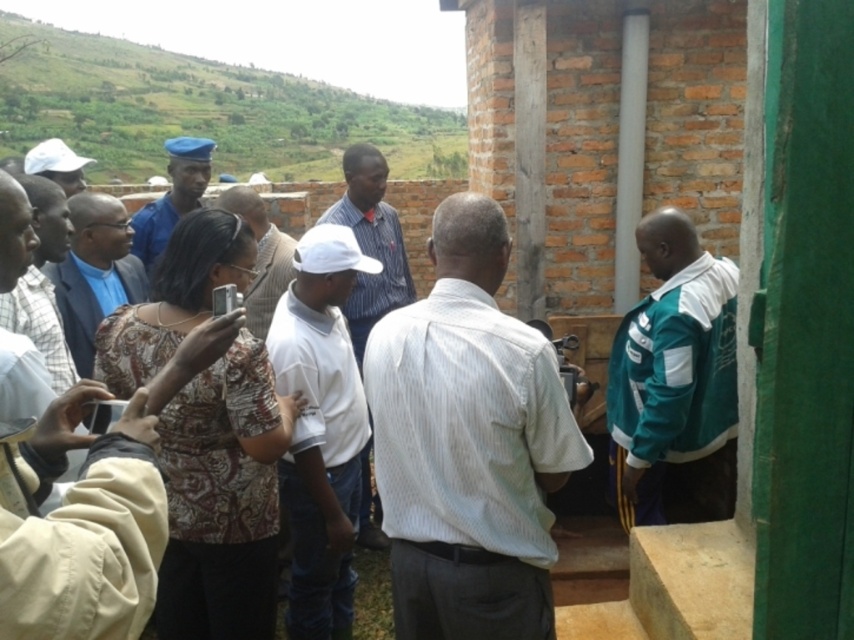
Can you confirm if blue uniform at center is positioned below white matte cap at upper left?

Yes, blue uniform at center is below white matte cap at upper left.

From the picture: Is blue uniform at center to the left of white matte cap at upper left from the viewer's perspective?

No, blue uniform at center is not to the left of white matte cap at upper left.

The height and width of the screenshot is (640, 854). I want to click on blue uniform at center, so click(173, 196).

This screenshot has width=854, height=640. I want to click on blue uniform at center, so click(x=173, y=196).

Can you confirm if white textured shirt at center is bigger than matte blue shirt at center?

Correct, white textured shirt at center is larger in size than matte blue shirt at center.

Can you confirm if white textured shirt at center is smaller than matte blue shirt at center?

Actually, white textured shirt at center might be larger than matte blue shirt at center.

Image resolution: width=854 pixels, height=640 pixels. I want to click on white textured shirt at center, so click(468, 442).

Where is `white textured shirt at center`? The height and width of the screenshot is (640, 854). white textured shirt at center is located at coordinates (468, 442).

Is white textured shirt at center thinner than white matte cap at upper left?

Correct, white textured shirt at center's width is less than white matte cap at upper left's.

Describe the element at coordinates (468, 442) in the screenshot. I see `white textured shirt at center` at that location.

Is point (533, 572) farther from camera compared to point (50, 154)?

No, it is not.

The height and width of the screenshot is (640, 854). Find the location of `white textured shirt at center`. white textured shirt at center is located at coordinates (468, 442).